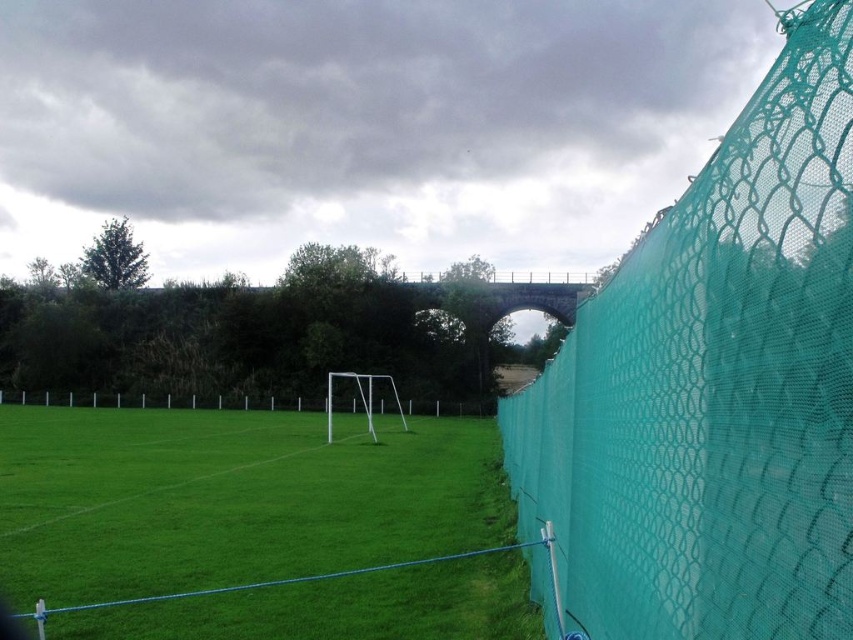
You are a soccer player standing at the edge of the field. You need to quickly retrieve a ball that rolled towards the green grass at lower left and the green mesh fence at center. Which direction should you run to reach the ball first?

The green grass at lower left is to the right of green mesh fence at center, so you should run to the right to reach the ball first.

You are a soccer player standing at the center of the field near the white soccer goalpost. You want to kick the ball towards the teal mesh fence at right. Will the ball land on the green grass at lower left or somewhere else?

The teal mesh fence at right is positioned over green grass at lower left, so the ball will land on the green grass at lower left.

You are standing at the edge of the field looking towards the teal fence. There are two points marked on the field, point (720, 390) and point (260, 408). Which point is closer to you?

Point (720, 390) is closer to the camera than point (260, 408), so the point closer to you is point (720, 390).